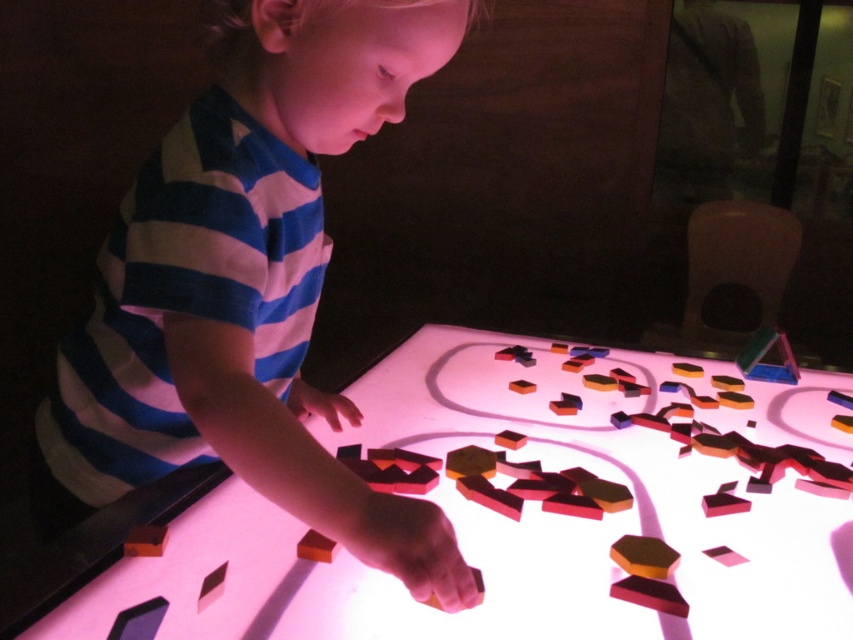
Question: Which of these objects is positioned closest to the translucent plastic table at center?

Choices:
 (A) rubber cube at lower center
 (B) rubberized plastic block at lower left
 (C) blue striped shirt at upper left

Answer: (C)

Question: Considering the relative positions of blue striped shirt at upper left and rubber cube at lower center in the image provided, where is blue striped shirt at upper left located with respect to rubber cube at lower center?

Choices:
 (A) right
 (B) left

Answer: (B)

Question: Does translucent plastic table at center lie in front of rubber cube at lower center?

Choices:
 (A) no
 (B) yes

Answer: (B)

Question: Among these points, which one is farthest from the camera?

Choices:
 (A) (537, 621)
 (B) (126, 540)
 (C) (206, 413)
 (D) (746, 369)

Answer: (D)

Question: Where is blue striped shirt at upper left located in relation to translucent plastic triangle at upper right in the image?

Choices:
 (A) left
 (B) right

Answer: (A)

Question: Among these points, which one is farthest from the camera?

Choices:
 (A) (254, 38)
 (B) (128, 538)
 (C) (758, 358)
 (D) (573, 392)

Answer: (C)